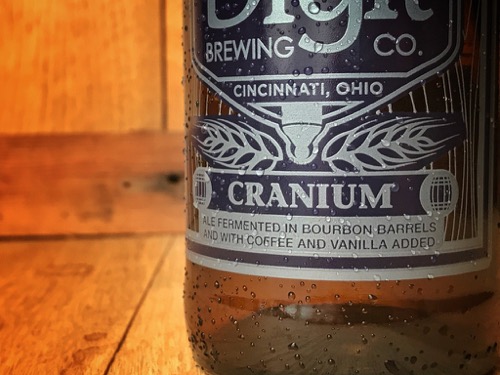
Locate an element on the screen. beer bottle is located at coordinates (400, 288).